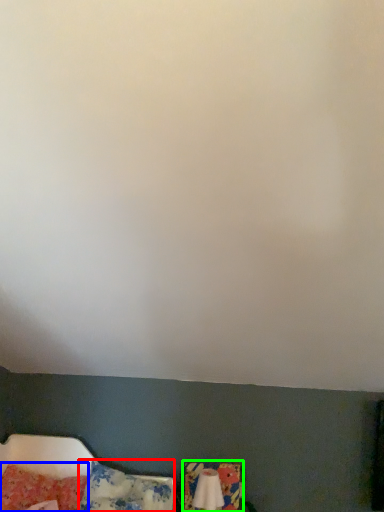
Question: Which is farther away from pillow (highlighted by a red box)? pillow (highlighted by a blue box) or swivel chair (highlighted by a green box)?

Choices:
 (A) pillow
 (B) swivel chair

Answer: (B)